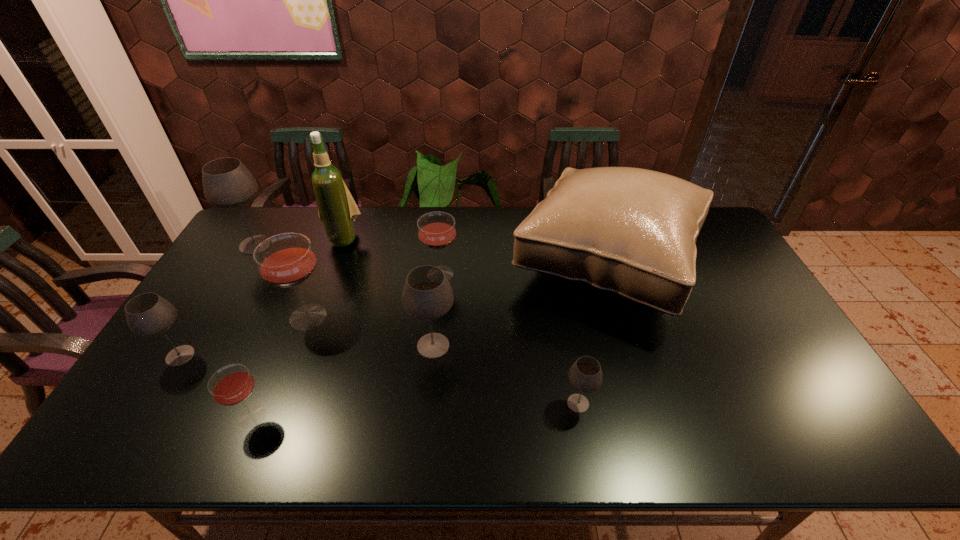
In the image, there is a desktop. Where is `vacant space at the left edge`? vacant space at the left edge is located at coordinates (252, 296).

In the image, there is a desktop. Identify the location of free region at the right edge. The height and width of the screenshot is (540, 960). tap(735, 328).

Identify the location of free space between the tallest object and the rightmost gray wineglass. Image resolution: width=960 pixels, height=540 pixels. (461, 321).

The height and width of the screenshot is (540, 960). What are the coordinates of `free space between the rightmost wineglass and the wine bottle` in the screenshot? It's located at (461, 321).

Locate an element on the screen. free space between the second smallest gray wineglass and the tallest wineglass is located at coordinates (218, 300).

This screenshot has height=540, width=960. I want to click on free space between the smallest gray wineglass and the third gray wineglass from left to right, so click(x=506, y=374).

At what (x,y) coordinates should I click in order to perform the action: click on unoccupied position between the smallest red wineglass and the farthest wineglass. Please return your answer as a coordinate pair (x, y). The width and height of the screenshot is (960, 540). Looking at the image, I should click on (253, 331).

This screenshot has height=540, width=960. I want to click on free point between the nearest red wineglass and the rightmost red wineglass, so click(347, 345).

Image resolution: width=960 pixels, height=540 pixels. I want to click on free space between the farthest wineglass and the cushion, so click(430, 254).

I want to click on empty space between the biggest red wineglass and the smallest red wineglass, so click(280, 367).